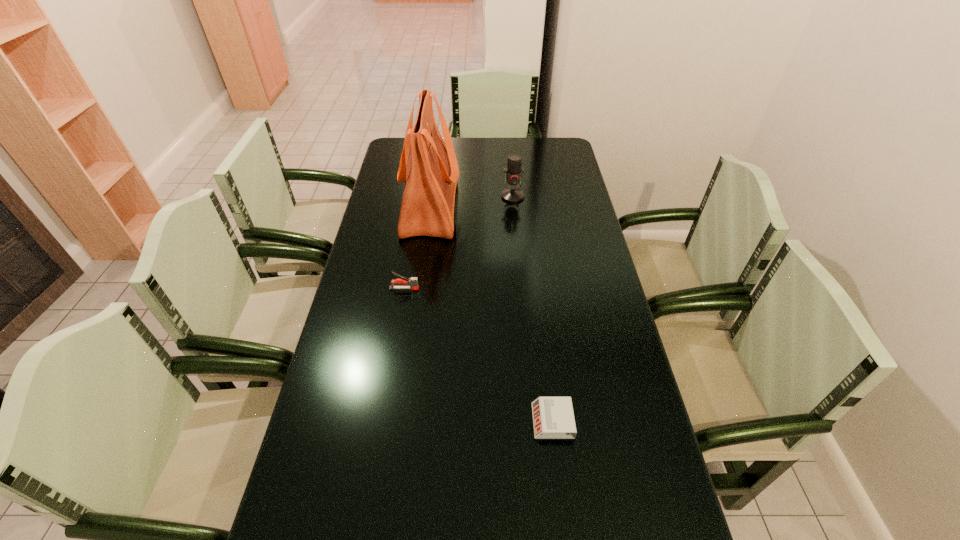
Identify the location of free space that satisfies the following two spatial constraints: 1. on the handle side of the nearest object; 2. on the left side of the stapler. The width and height of the screenshot is (960, 540). (382, 421).

Locate an element on the screen. The height and width of the screenshot is (540, 960). free location that satisfies the following two spatial constraints: 1. on the front pocket of the alarm clock; 2. on the right side of the tallest object is located at coordinates (401, 421).

The width and height of the screenshot is (960, 540). Identify the location of free point that satisfies the following two spatial constraints: 1. on the side of the second tallest object with the red ring; 2. on the front pocket of the shopping bag. (514, 207).

What are the coordinates of `free space that satisfies the following two spatial constraints: 1. on the side of the second tallest object with the red ring; 2. on the right side of the shortest object` in the screenshot? It's located at (533, 421).

Find the location of a particular element. free space that satisfies the following two spatial constraints: 1. on the side of the second tallest object with the red ring; 2. on the front pocket of the shopping bag is located at coordinates (514, 207).

At what (x,y) coordinates should I click in order to perform the action: click on vacant area in the image that satisfies the following two spatial constraints: 1. on the back side of the nearest object; 2. on the front pocket of the tallest object. Please return your answer as a coordinate pair (x, y). Looking at the image, I should click on (526, 207).

At what (x,y) coordinates should I click in order to perform the action: click on free space that satisfies the following two spatial constraints: 1. on the side of the third shortest object with the red ring; 2. on the front pocket of the tallest object. Please return your answer as a coordinate pair (x, y). This screenshot has height=540, width=960. Looking at the image, I should click on (514, 207).

This screenshot has width=960, height=540. In order to click on free location that satisfies the following two spatial constraints: 1. on the handle side of the second shortest object; 2. on the right side of the shortest object in this screenshot , I will do `click(382, 421)`.

I want to click on free space that satisfies the following two spatial constraints: 1. on the front pocket of the shopping bag; 2. on the back side of the shortest object, so pyautogui.click(x=401, y=421).